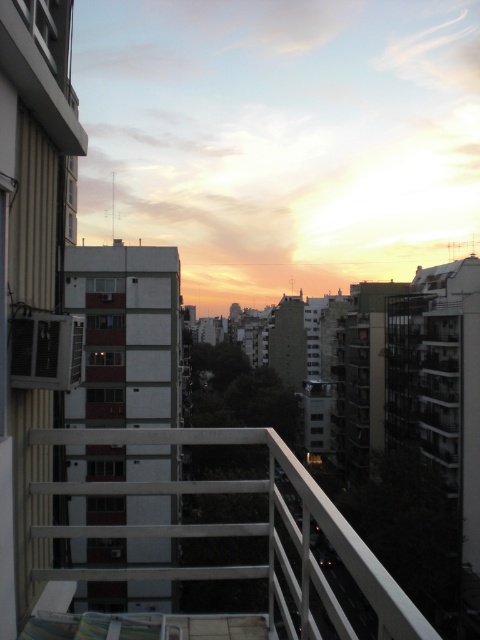
Question: Can you confirm if white metal railing at center is positioned above matte white balcony at lower left?

Choices:
 (A) yes
 (B) no

Answer: (B)

Question: Among these objects, which one is farthest from the camera?

Choices:
 (A) white metal railing at center
 (B) matte white balcony at lower left

Answer: (B)

Question: Is white metal railing at center to the left of matte white balcony at lower left from the viewer's perspective?

Choices:
 (A) no
 (B) yes

Answer: (A)

Question: Is the position of white metal railing at center less distant than that of matte white balcony at lower left?

Choices:
 (A) no
 (B) yes

Answer: (B)